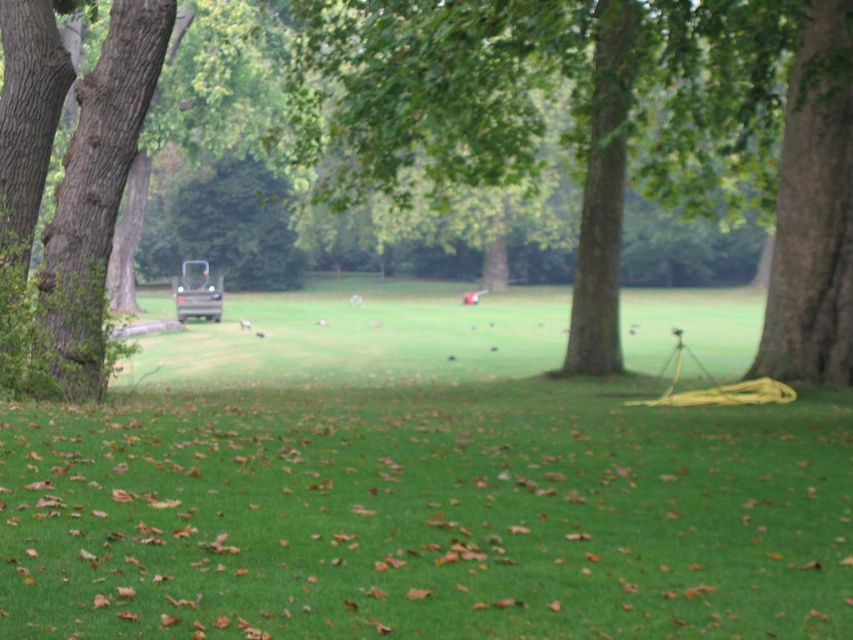
Between green grass at center and brown rough tree at center, which one appears on the right side from the viewer's perspective?

From the viewer's perspective, green grass at center appears more on the right side.

Consider the image. Is green grass at center above brown rough tree at center?

Incorrect, green grass at center is not positioned above brown rough tree at center.

Which is in front, point (21, 435) or point (343, 164)?

Point (21, 435) is more forward.

Identify the location of green grass at center. The width and height of the screenshot is (853, 640). coord(415,492).